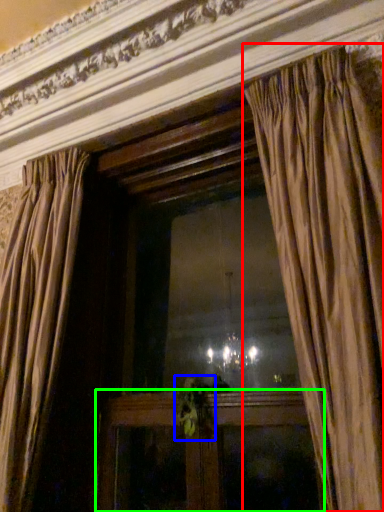
Question: Estimate the real-world distances between objects in this image. Which object is farther from curtain (highlighted by a red box), plant (highlighted by a blue box) or furniture (highlighted by a green box)?

Choices:
 (A) plant
 (B) furniture

Answer: (A)